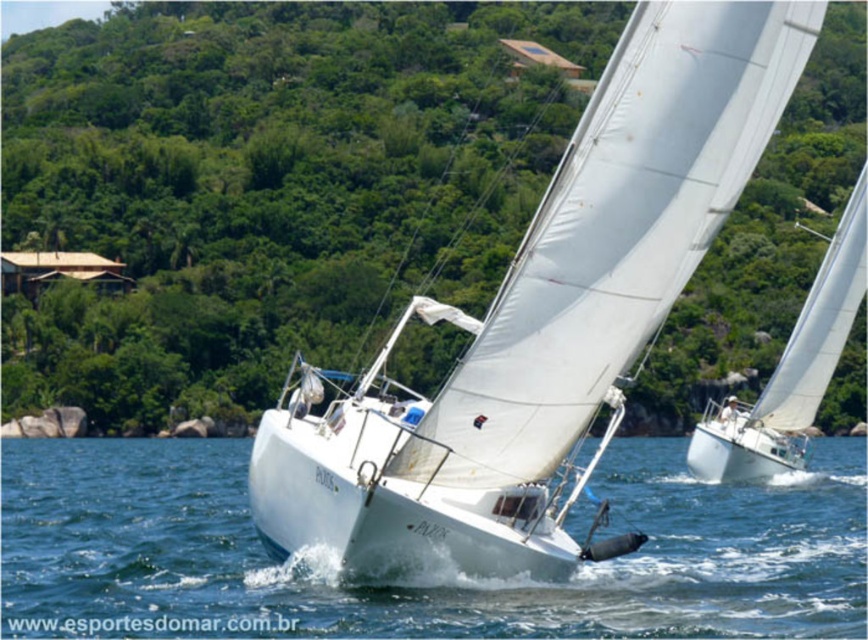
You are a spectator watching the sailboat race from the shore. You notice the clear blue water at center and the white matte sailboat at right. Which one is closer to you?

The clear blue water at center is closer to you because it is in front of the white matte sailboat at right.

From the picture: You are a spectator watching the sailboat race. You see the white matte sailboat at center and the white matte sailboat at right. Which one is positioned to the left?

The white matte sailboat at center is positioned to the left of the white matte sailboat at right.